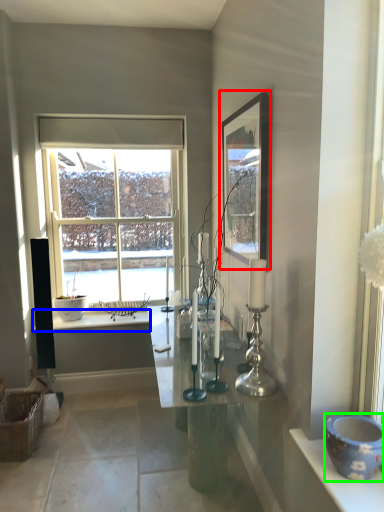
Question: Considering the real-world distances, which object is farthest from picture frame (highlighted by a red box)? counter top (highlighted by a blue box) or pottery (highlighted by a green box)?

Choices:
 (A) counter top
 (B) pottery

Answer: (A)